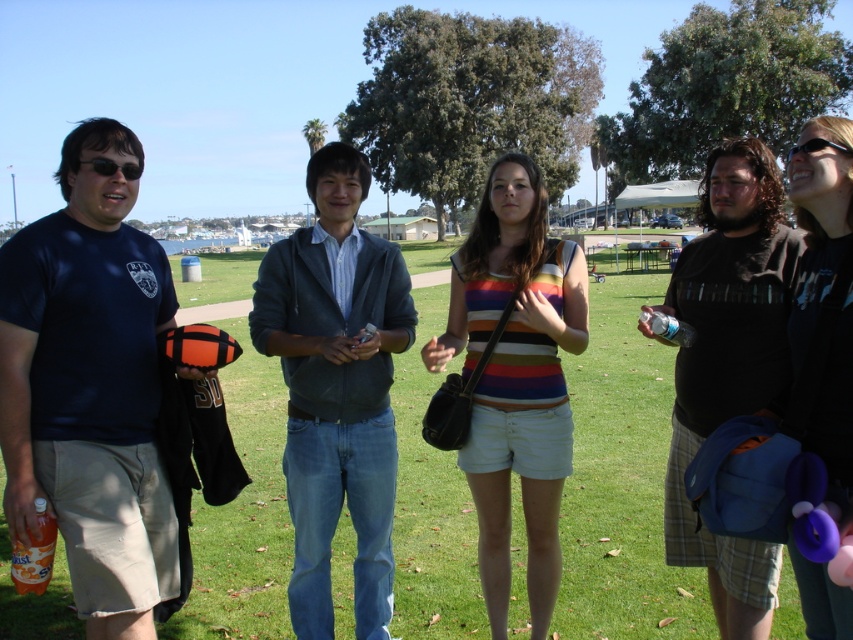
Looking at this image, which of these two, green grass at center or striped cotton tank top at center, stands taller?

green grass at center

Between point (622, 387) and point (549, 486), which one is positioned behind?

Positioned behind is point (622, 387).

Image resolution: width=853 pixels, height=640 pixels. I want to click on green grass at center, so pyautogui.click(x=621, y=481).

Consider the image. Is matte blue t-shirt at left thinner than dark brown textured shirt at right?

Yes, matte blue t-shirt at left is thinner than dark brown textured shirt at right.

At what (x,y) coordinates should I click in order to perform the action: click on matte blue t-shirt at left. Please return your answer as a coordinate pair (x, y). The image size is (853, 640). Looking at the image, I should click on (90, 387).

Does point (308, 397) lie in front of point (676, 397)?

No.

Looking at this image, who is lower down, dark gray hoodie at center or dark brown textured shirt at right?

dark brown textured shirt at right is below.

Find the location of a particular element. The height and width of the screenshot is (640, 853). dark gray hoodie at center is located at coordinates (335, 388).